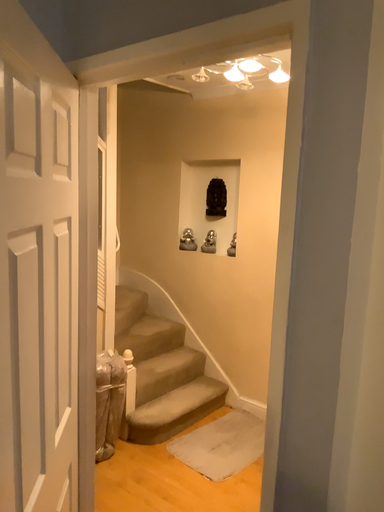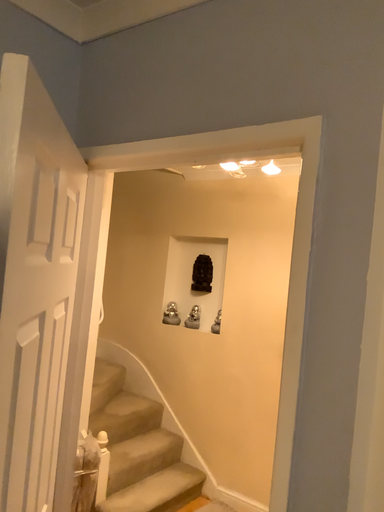
Question: How did the camera likely rotate when shooting the video?

Choices:
 (A) rotated downward
 (B) rotated upward

Answer: (B)